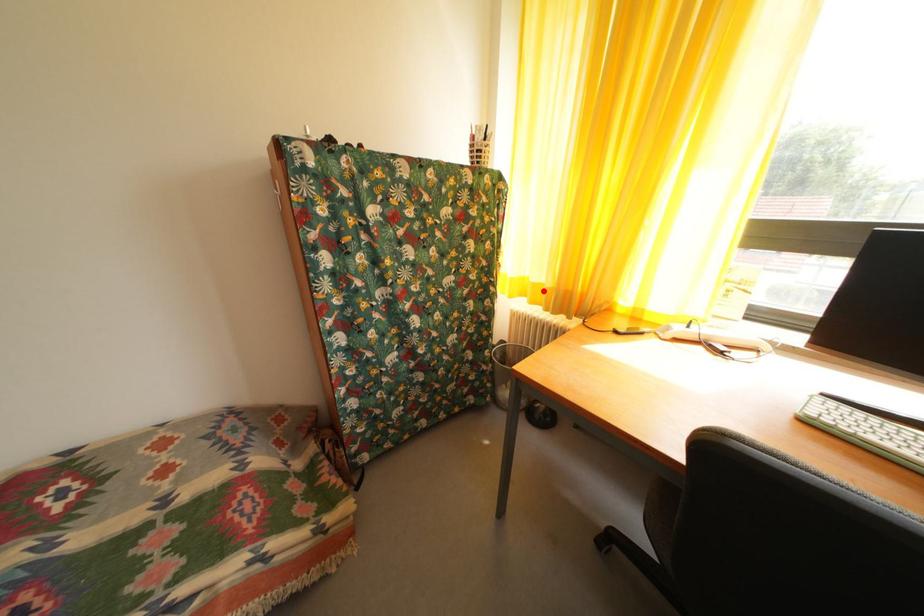
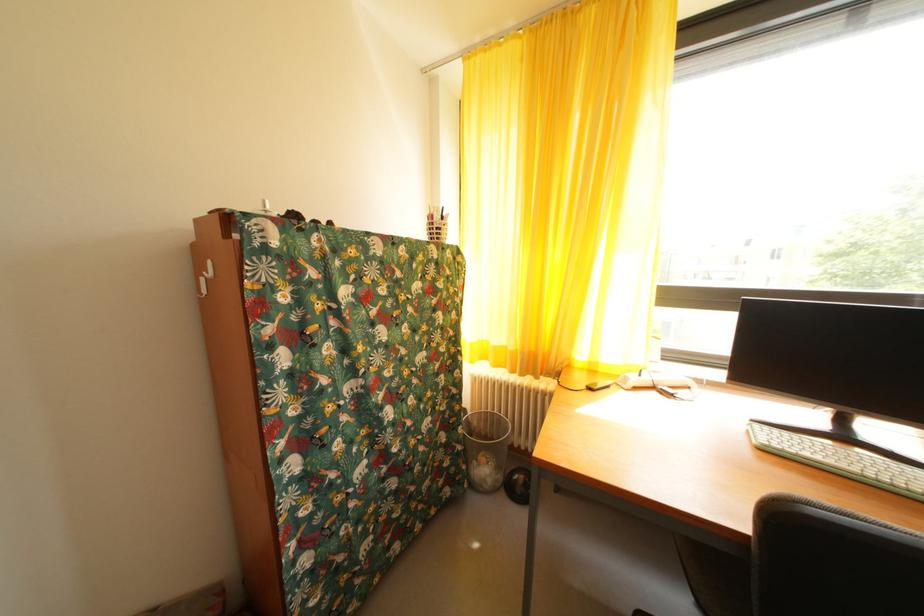
In the second image, find the point that corresponds to the highlighted location in the first image.

(505, 354)